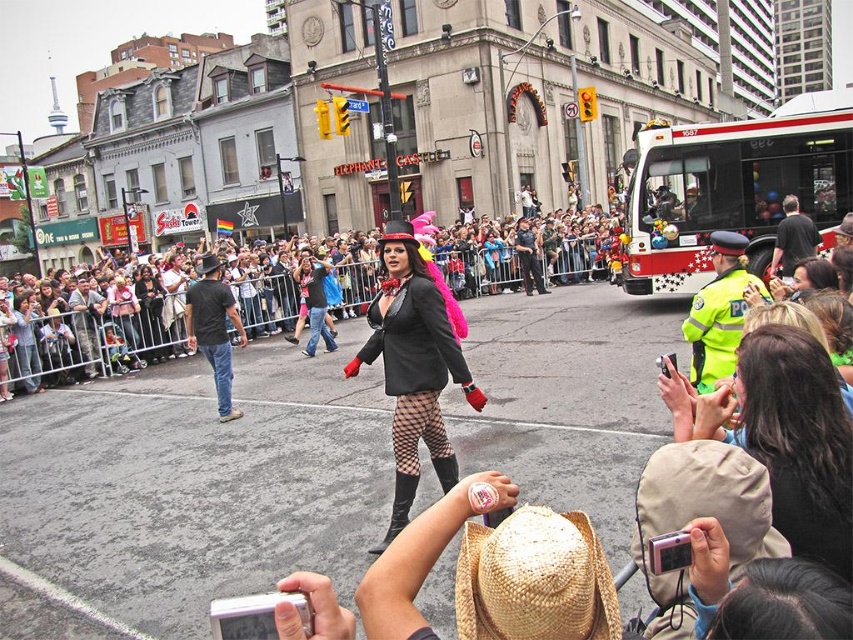
Is white plastic bus at right wider than matte black jacket at center?

No.

Which is more to the right, white plastic bus at right or matte black jacket at center?

Positioned to the right is white plastic bus at right.

Find the location of a particular element. white plastic bus at right is located at coordinates (734, 188).

At what (x,y) coordinates should I click in order to perform the action: click on white plastic bus at right. Please return your answer as a coordinate pair (x, y). Looking at the image, I should click on (734, 188).

Who is positioned more to the right, straw hat at lower center or matte black coat at center?

Positioned to the right is straw hat at lower center.

Between straw hat at lower center and matte black coat at center, which one has less height?

Standing shorter between the two is straw hat at lower center.

At what (x,y) coordinates should I click in order to perform the action: click on straw hat at lower center. Please return your answer as a coordinate pair (x, y). The image size is (853, 640). Looking at the image, I should click on (534, 579).

Can you confirm if straw hat at lower center is bigger than brown leather jacket at left?

Yes, straw hat at lower center is bigger than brown leather jacket at left.

From the picture: Does straw hat at lower center appear on the left side of brown leather jacket at left?

Incorrect, straw hat at lower center is not on the left side of brown leather jacket at left.

Where is `straw hat at lower center`? Image resolution: width=853 pixels, height=640 pixels. straw hat at lower center is located at coordinates (534, 579).

This screenshot has width=853, height=640. Identify the location of straw hat at lower center. (534, 579).